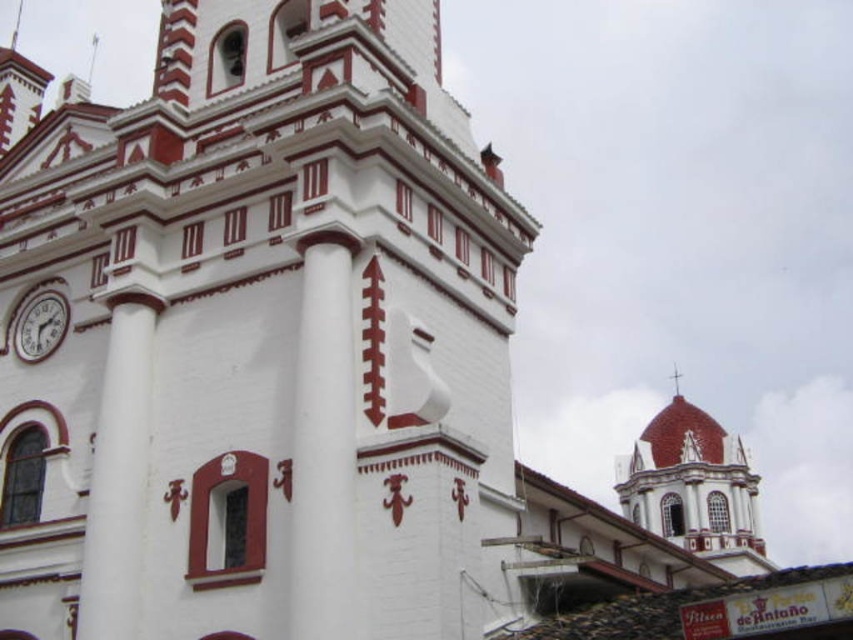
Does white marble column at center have a greater width compared to white smooth column at left?

No, white marble column at center is not wider than white smooth column at left.

Who is more forward, (317, 570) or (100, 520)?

Point (317, 570)

Who is more distant from viewer, (349,273) or (120,387)?

The point (120,387) is more distant.

At what (x,y) coordinates should I click in order to perform the action: click on white marble column at center. Please return your answer as a coordinate pair (x, y). This screenshot has height=640, width=853. Looking at the image, I should click on (323, 444).

In the scene shown: Is white smooth column at left above white glossy clock at upper left?

No.

From the picture: Is white smooth column at left positioned before white glossy clock at upper left?

Yes.

Who is more forward, (106, 449) or (24, 344)?

Point (106, 449) is more forward.

The height and width of the screenshot is (640, 853). Find the location of `white smooth column at left`. white smooth column at left is located at coordinates (119, 476).

Is white marble column at center positioned before white glossy clock at upper left?

That is True.

Can you confirm if white marble column at center is thinner than white glossy clock at upper left?

Correct, white marble column at center's width is less than white glossy clock at upper left's.

Who is more forward, [314,481] or [67,312]?

Positioned in front is point [314,481].

I want to click on white marble column at center, so click(x=323, y=444).